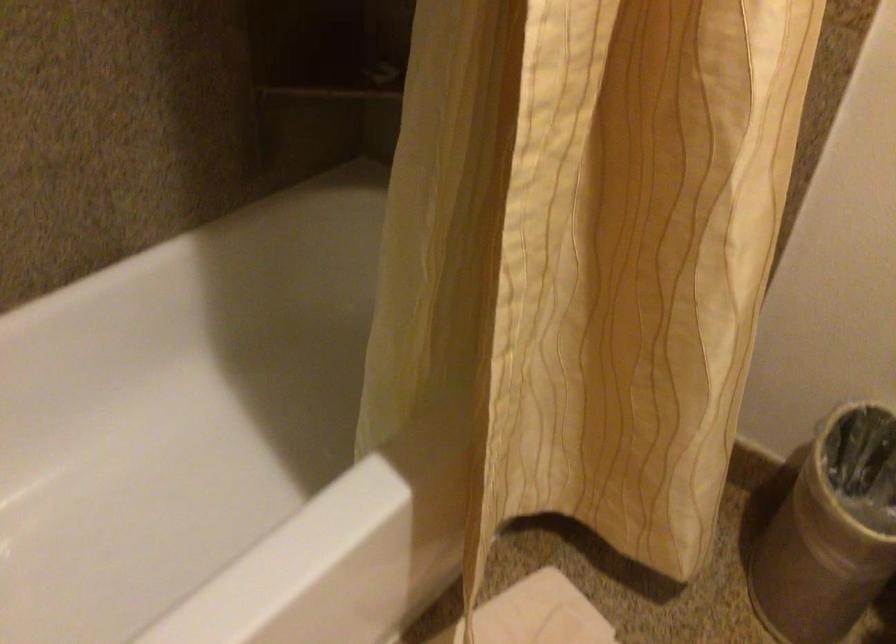
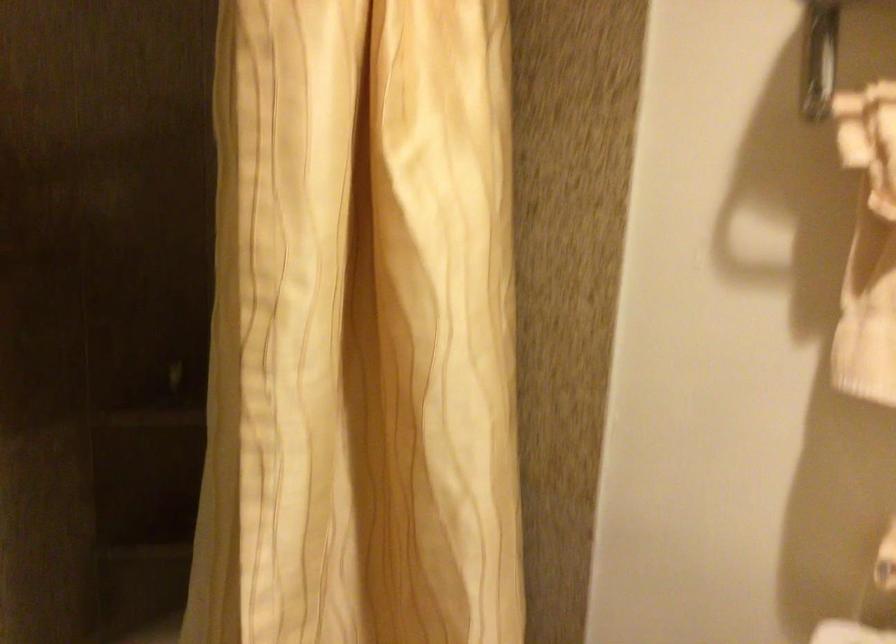
Question: The first image is from the beginning of the video and the second image is from the end. How did the camera likely rotate when shooting the video?

Choices:
 (A) Left
 (B) Right
 (C) Up
 (D) Down

Answer: (C)